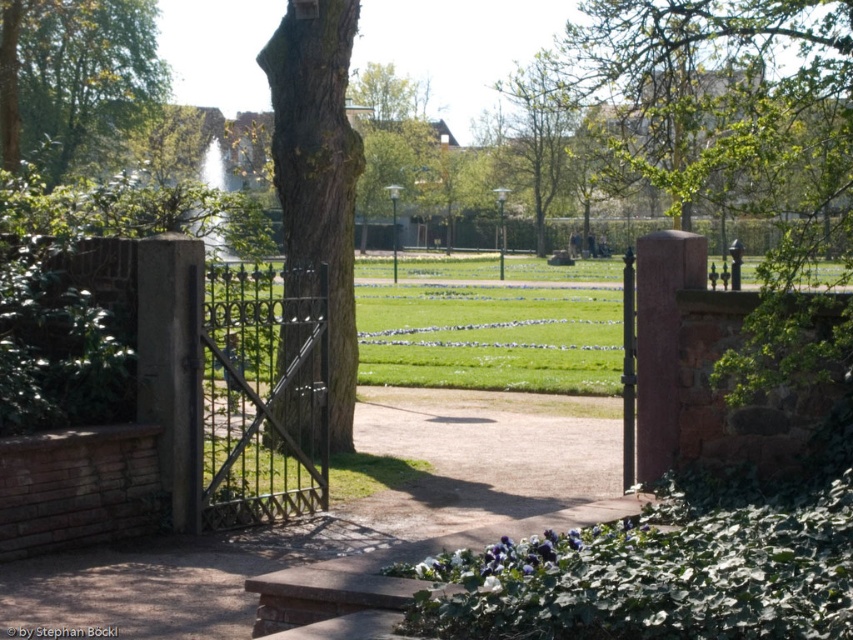
Question: Is smooth bark tree at center above green leafy tree at upper center?

Choices:
 (A) no
 (B) yes

Answer: (A)

Question: Which point is farther to the camera?

Choices:
 (A) (329, 548)
 (B) (300, 122)

Answer: (B)

Question: Is brown stone path at center positioned behind green leafy tree at upper center?

Choices:
 (A) no
 (B) yes

Answer: (A)

Question: Observing the image, what is the correct spatial positioning of smooth bark tree at center in reference to green leafy tree at upper center?

Choices:
 (A) left
 (B) right

Answer: (A)

Question: Which point is farther to the camera?

Choices:
 (A) dark brown wrought iron gate at center
 (B) brown stone path at center
 (C) green leafy tree at upper center
 (D) smooth bark tree at center

Answer: (C)

Question: Which of these objects is positioned closest to the dark brown wrought iron gate at center?

Choices:
 (A) smooth bark tree at center
 (B) green leafy tree at upper left

Answer: (A)